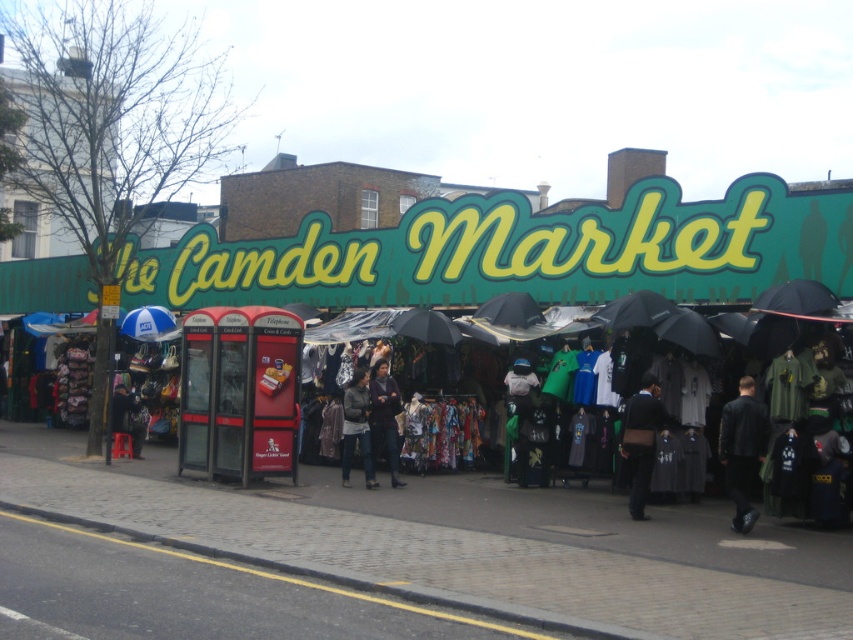
Question: Observing the image, what is the correct spatial positioning of matte black umbrella at center in reference to black matte umbrella at center?

Choices:
 (A) left
 (B) right

Answer: (A)

Question: In this image, where is dark brown leather bag at center located relative to dark brown leather jacket at center?

Choices:
 (A) right
 (B) left

Answer: (A)

Question: Among these objects, which one is farthest from the camera?

Choices:
 (A) black leather jacket at lower right
 (B) blue glossy umbrella at center
 (C) dark brown leather jacket at center

Answer: (B)

Question: Which point is closer to the camera taking this photo?

Choices:
 (A) (450, 336)
 (B) (728, 452)
 (C) (525, 602)

Answer: (C)

Question: Which point is farther to the camera?

Choices:
 (A) dark gray fabric jacket at center
 (B) dark brown leather jacket at center
 (C) matte black umbrella at center

Answer: (B)

Question: Does matte black umbrella at center appear under dark gray fabric jacket at center?

Choices:
 (A) no
 (B) yes

Answer: (A)